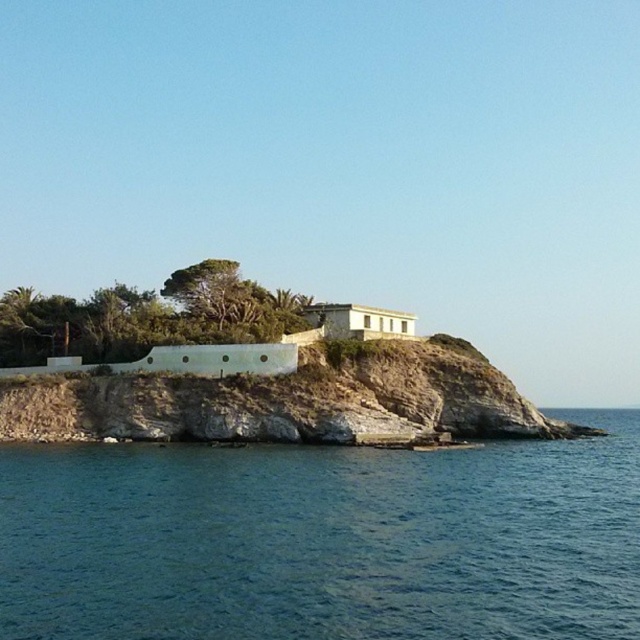
Question: Among these objects, which one is nearest to the camera?

Choices:
 (A) brown rocky cliff at center
 (B) blue water at lower left

Answer: (B)

Question: Does blue water at lower left have a greater width compared to brown rocky cliff at center?

Choices:
 (A) no
 (B) yes

Answer: (A)

Question: Is blue water at lower left thinner than brown rocky cliff at center?

Choices:
 (A) yes
 (B) no

Answer: (A)

Question: Can you confirm if blue water at lower left is bigger than brown rocky cliff at center?

Choices:
 (A) no
 (B) yes

Answer: (A)

Question: Among these objects, which one is farthest from the camera?

Choices:
 (A) brown rocky cliff at center
 (B) blue water at lower left

Answer: (A)

Question: Which point is farther to the camera?

Choices:
 (A) (218, 387)
 (B) (589, 506)

Answer: (A)